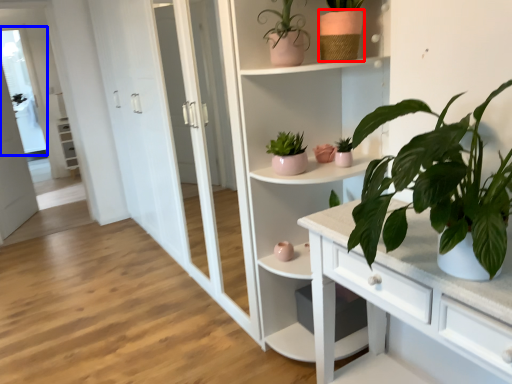
Question: Which point is further to the camera, flowerpot (highlighted by a red box) or window (highlighted by a blue box)?

Choices:
 (A) flowerpot
 (B) window

Answer: (B)